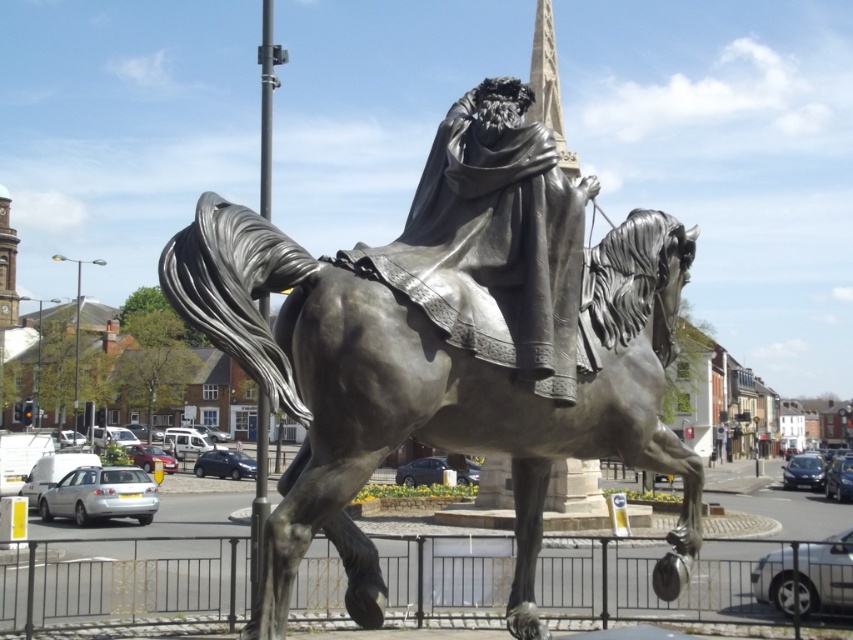
Can you confirm if bronze statue at center is bigger than bronze draped figure at center?

Indeed, bronze statue at center has a larger size compared to bronze draped figure at center.

Does bronze statue at center have a lesser width compared to bronze draped figure at center?

No.

Who is more distant from viewer, (372, 410) or (466, 150)?

The point (466, 150) is behind.

This screenshot has width=853, height=640. Identify the location of bronze statue at center. (444, 346).